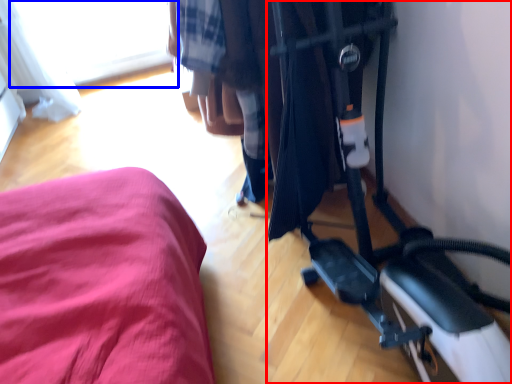
Question: Which point is closer to the camera, baby carriage (highlighted by a red box) or window (highlighted by a blue box)?

Choices:
 (A) baby carriage
 (B) window

Answer: (A)